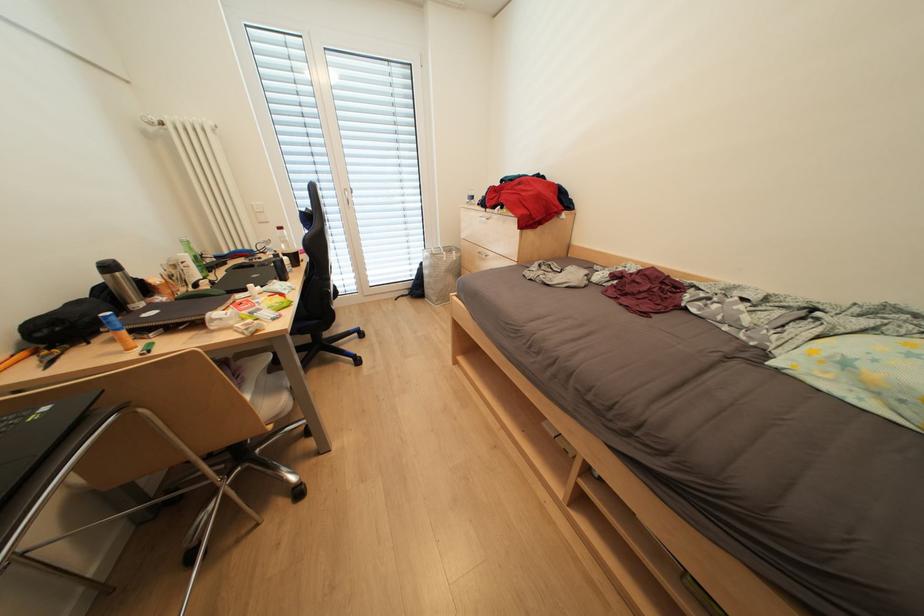
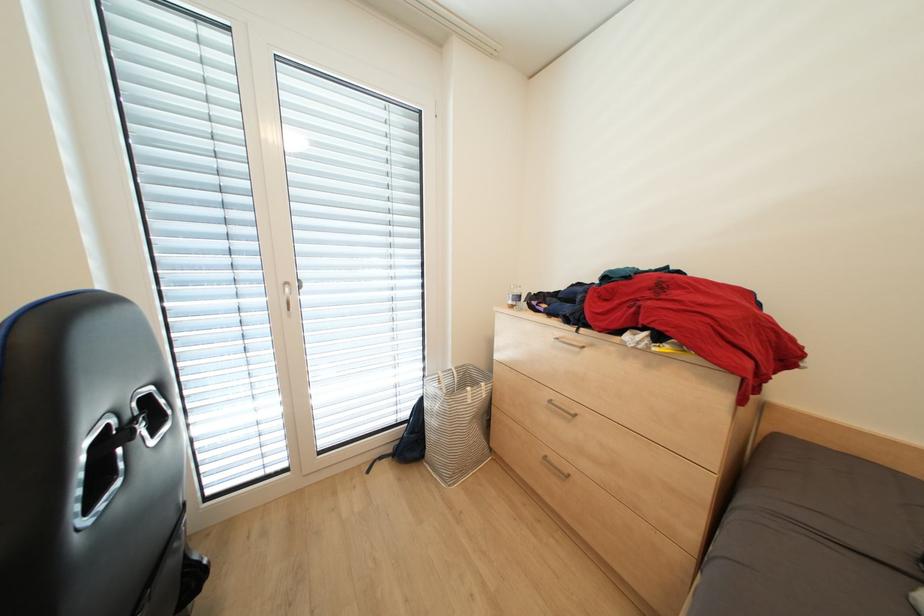
Looking at this image, the images are taken continuously from a first-person perspective. In which direction are you moving?

The cameraman moved toward left, forward.